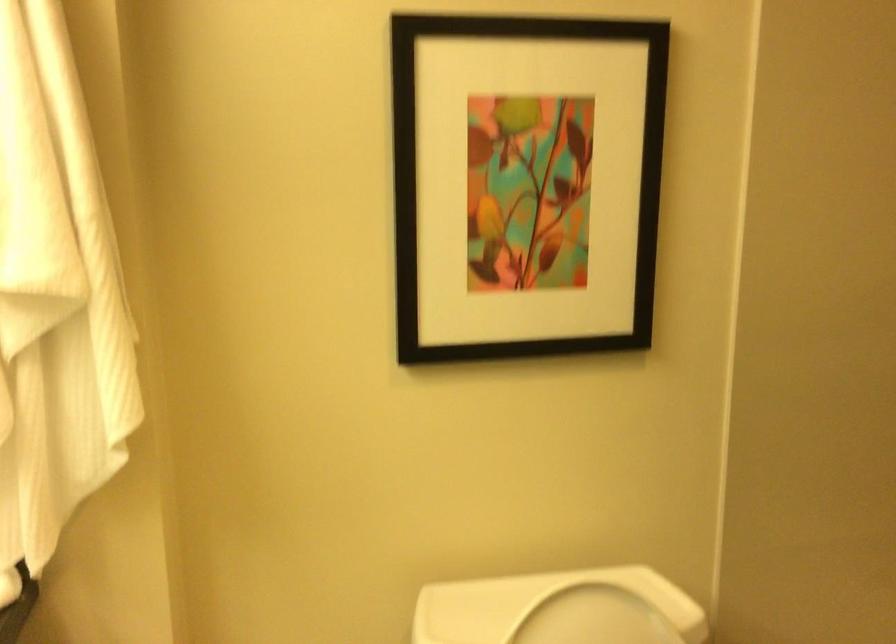
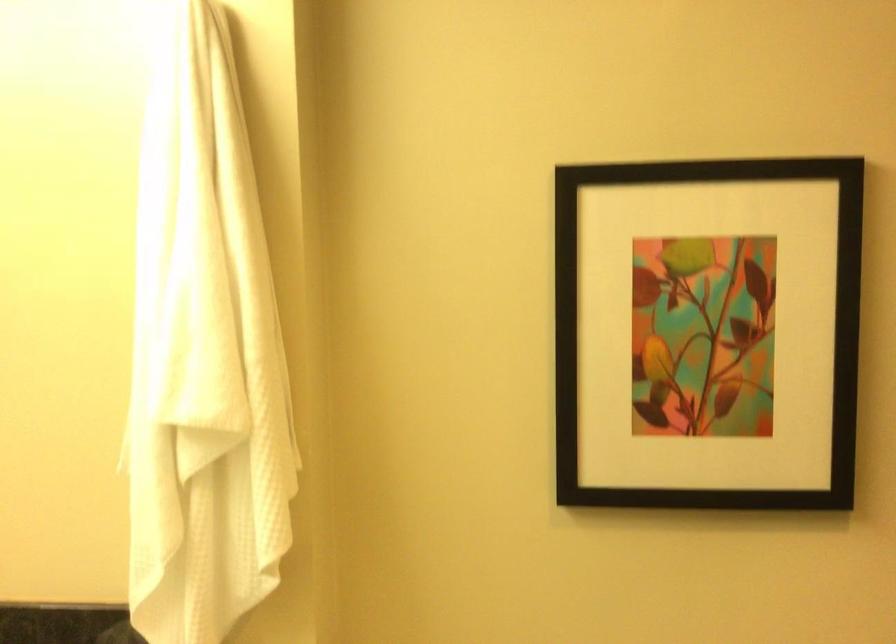
The point at (96, 120) is marked in the first image. Where is the corresponding point in the second image?

(279, 267)